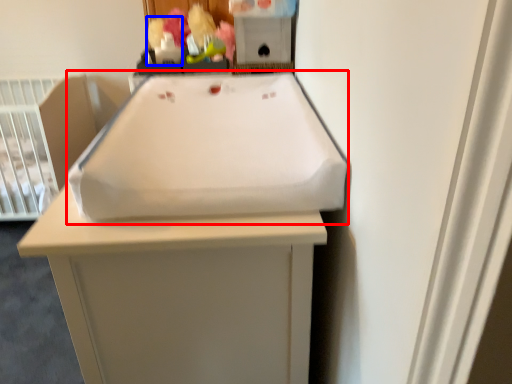
Question: Which of the following is the farthest to the observer, sink (highlighted by a red box) or toy (highlighted by a blue box)?

Choices:
 (A) sink
 (B) toy

Answer: (B)